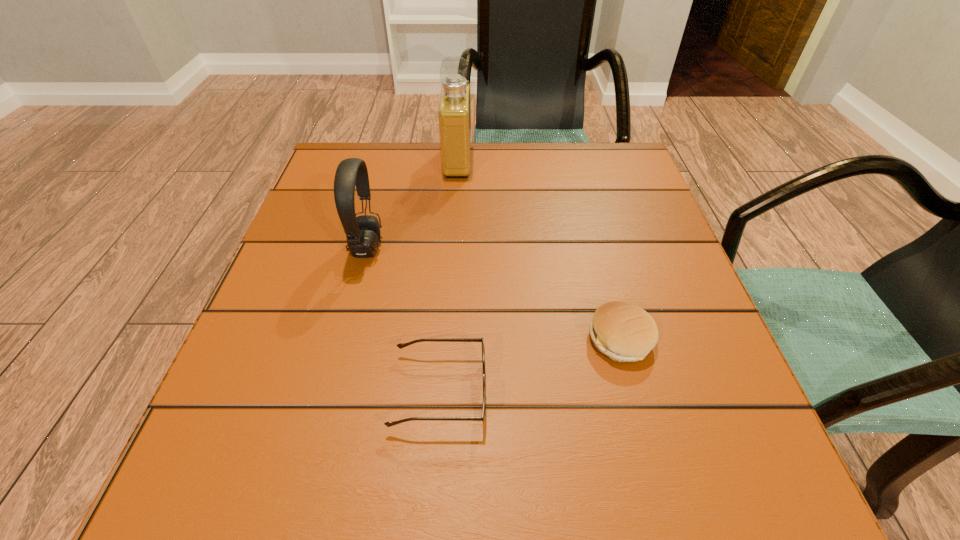
You are a GUI agent. You are given a task and a screenshot of the screen. Output one action in this format:
    pyautogui.click(x=<x>, y=<y>)
    Task: Click on the free space located 0.170m on the front lenses of the sunglasses
    The width and height of the screenshot is (960, 540).
    Given the screenshot: What is the action you would take?
    pyautogui.click(x=603, y=391)

Locate an element on the screen. The image size is (960, 540). object at the far edge is located at coordinates (454, 110).

The width and height of the screenshot is (960, 540). What are the coordinates of `object that is positioned at the left edge` in the screenshot? It's located at (363, 235).

In order to click on object present at the right edge in this screenshot , I will do `click(624, 332)`.

The height and width of the screenshot is (540, 960). Find the location of `free space at the far edge of the desktop`. free space at the far edge of the desktop is located at coordinates (468, 194).

Where is `vacant space at the left edge of the desktop`? This screenshot has width=960, height=540. vacant space at the left edge of the desktop is located at coordinates (291, 369).

The image size is (960, 540). Identify the location of vacant region at the right edge of the desktop. (612, 218).

I want to click on vacant space at the far left corner, so click(x=324, y=166).

In the image, there is a desktop. Where is `free space at the far right corner`? free space at the far right corner is located at coordinates (622, 176).

In the image, there is a desktop. Identify the location of vacant region at the near right corner. (688, 516).